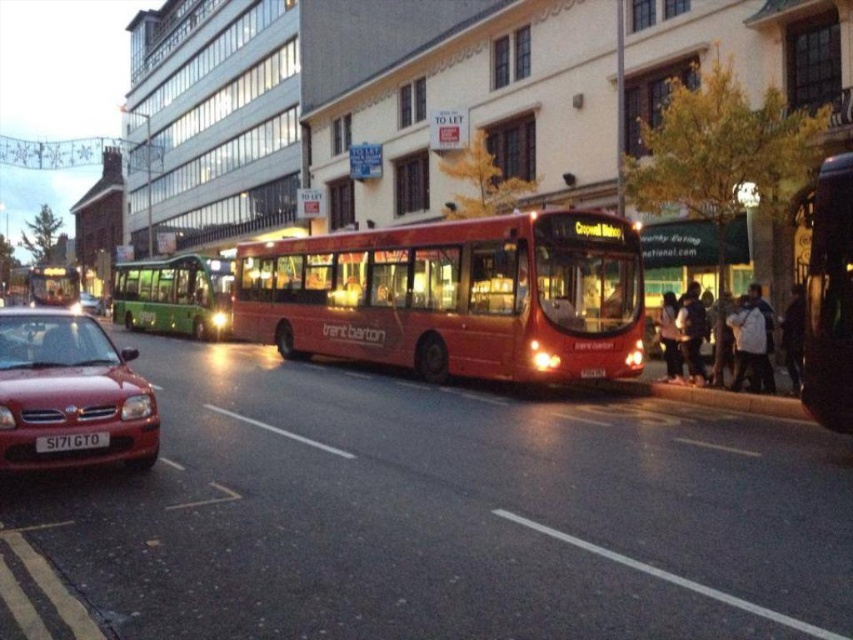
Question: From the image, what is the correct spatial relationship of shiny red bus at center in relation to metallic red car at left?

Choices:
 (A) below
 (B) above

Answer: (B)

Question: Which of the following is the closest to the observer?

Choices:
 (A) (152, 294)
 (B) (27, 276)
 (C) (38, 451)

Answer: (C)

Question: Does shiny red bus at center appear over black plastic license plate at center?

Choices:
 (A) yes
 (B) no

Answer: (A)

Question: Estimate the real-world distances between objects in this image. Which object is farther from the metallic red car at left?

Choices:
 (A) green metallic bus at left
 (B) shiny red bus at center

Answer: (B)

Question: Is green metallic bus at left above metallic red car at left?

Choices:
 (A) yes
 (B) no

Answer: (A)

Question: Which point is closer to the camera taking this photo?

Choices:
 (A) (358, 323)
 (B) (86, 298)

Answer: (A)